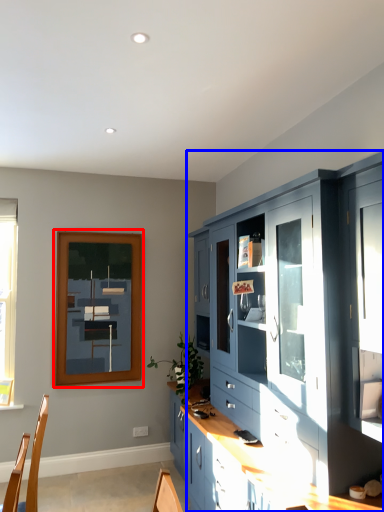
Question: Which object is further to the camera taking this photo, picture frame (highlighted by a red box) or cabinetry (highlighted by a blue box)?

Choices:
 (A) picture frame
 (B) cabinetry

Answer: (A)